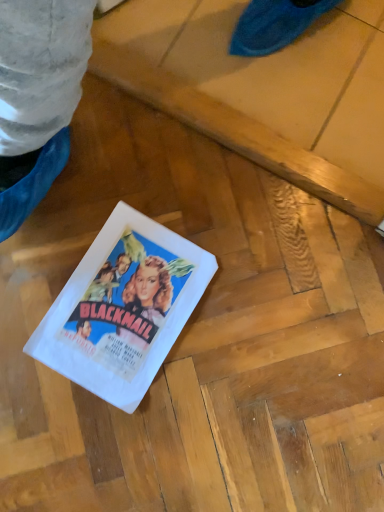
The image size is (384, 512). Find the location of `vacant space behind white matte book at center`. vacant space behind white matte book at center is located at coordinates (165, 182).